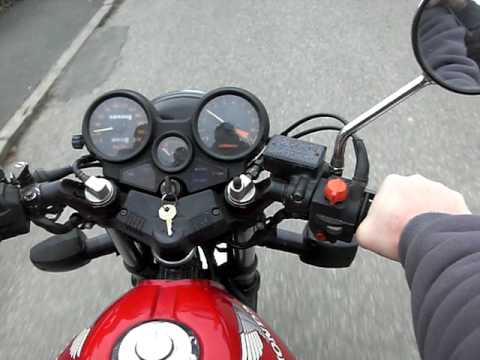
At what (x,y) coordinates should I click in order to perform the action: click on mirror. Please return your answer as a coordinate pair (x, y). Image resolution: width=480 pixels, height=360 pixels. Looking at the image, I should click on (456, 37).